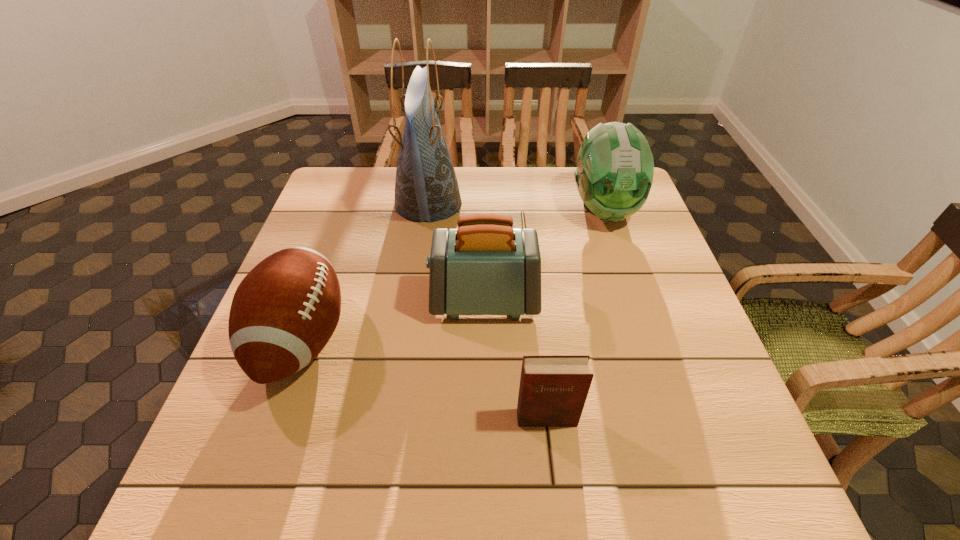
Identify which object is the closest to the football. Please provide its 2D coordinates. Your answer should be formatted as a tuple, i.e. [(x, y)], where the tuple contains the x and y coordinates of a point satisfying the conditions above.

[(485, 267)]

The width and height of the screenshot is (960, 540). Identify the location of vacant space that satisfies the following two spatial constraints: 1. on the visor of the rightmost object; 2. on the laces of the football. (647, 339).